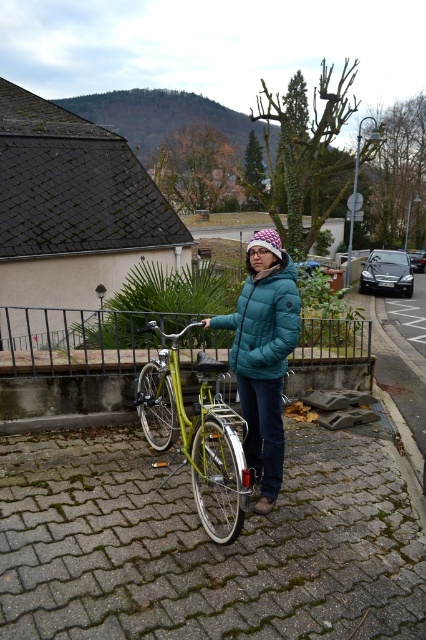
In the scene shown: You are a fashion designer observing a person wearing two jackets. The teal quilted jacket at center and the teal down jacket at center. Which one is taller?

The teal quilted jacket at center is taller than the teal down jacket at center.